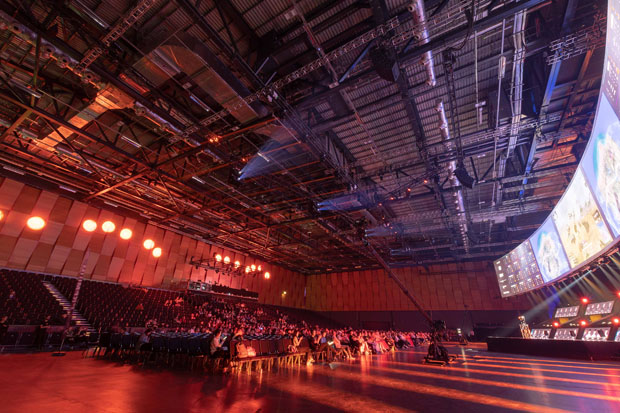
Find the location of `ceiling`. ceiling is located at coordinates (358, 136).